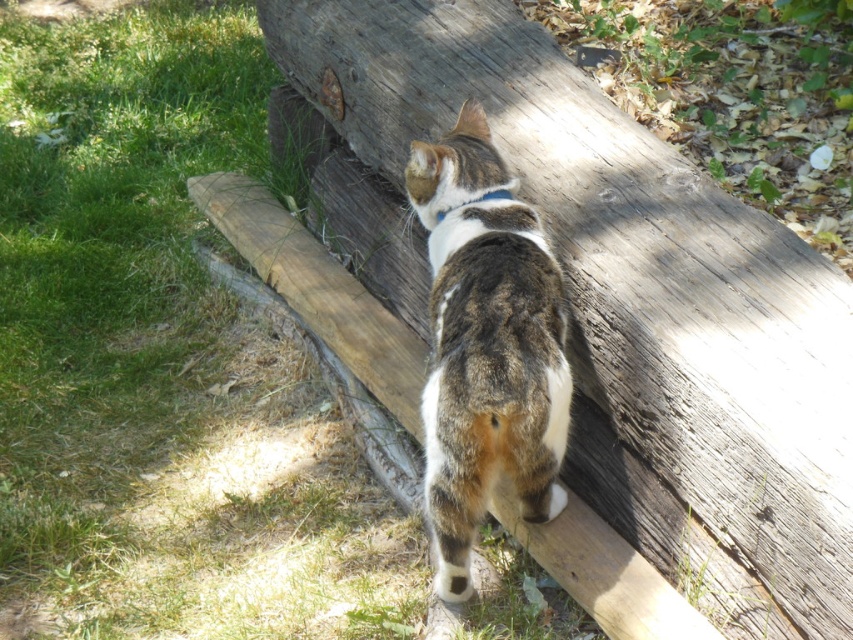
You are standing in front of the wooden structure and see the tabby fur cat at center and the weathered wood at center. Which object is positioned to the left of the other?

The weathered wood at center is to the left of the tabby fur cat at center.

You are standing at the camera position observing the scene. Where is the weathered wood at center located in terms of coordinates?

The weathered wood at center is located at the coordinates point (633, 300).